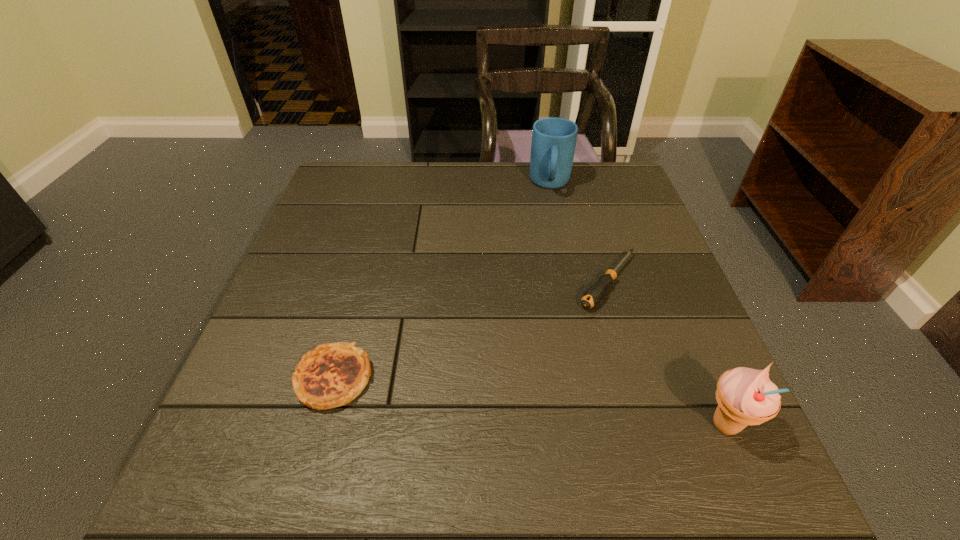
This screenshot has width=960, height=540. Find the location of `free space located 0.150m on the side of the farthest object with the handle`. free space located 0.150m on the side of the farthest object with the handle is located at coordinates point(552,234).

This screenshot has height=540, width=960. What are the coordinates of `free location located on the side of the farthest object with the handle` in the screenshot? It's located at pyautogui.click(x=552, y=239).

At what (x,y) coordinates should I click in order to perform the action: click on object that is at the far edge. Please return your answer as a coordinate pair (x, y). The width and height of the screenshot is (960, 540). Looking at the image, I should click on (553, 144).

The height and width of the screenshot is (540, 960). I want to click on quiche that is at the near edge, so click(x=333, y=374).

In order to click on icecream situated at the near edge in this screenshot , I will do `click(745, 396)`.

The height and width of the screenshot is (540, 960). I want to click on object at the left edge, so click(333, 374).

You are a GUI agent. You are given a task and a screenshot of the screen. Output one action in this format:
    pyautogui.click(x=<x>, y=<y>)
    Task: Click on the icecream situated at the right edge
    The width and height of the screenshot is (960, 540).
    Given the screenshot: What is the action you would take?
    pyautogui.click(x=745, y=396)

At what (x,y) coordinates should I click in order to perform the action: click on screwdriver positioned at the right edge. Please return your answer as a coordinate pair (x, y). Looking at the image, I should click on (595, 293).

Identify the location of object positioned at the near left corner. (333, 374).

Find the location of `object positioned at the near right corner`. object positioned at the near right corner is located at coordinates (745, 396).